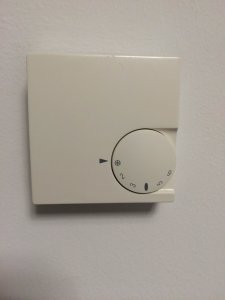
The width and height of the screenshot is (225, 300). In order to click on wall in this screenshot , I will do `click(184, 226)`.